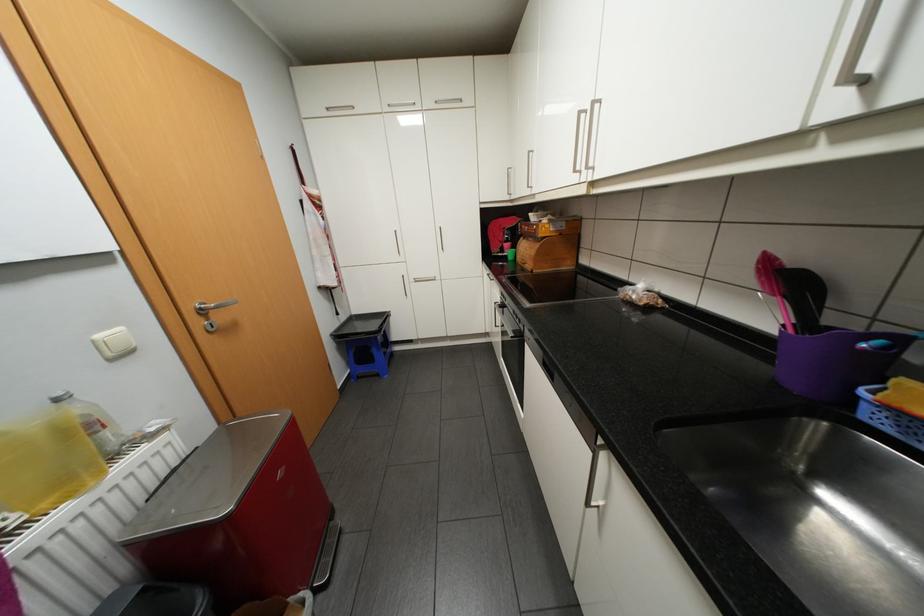
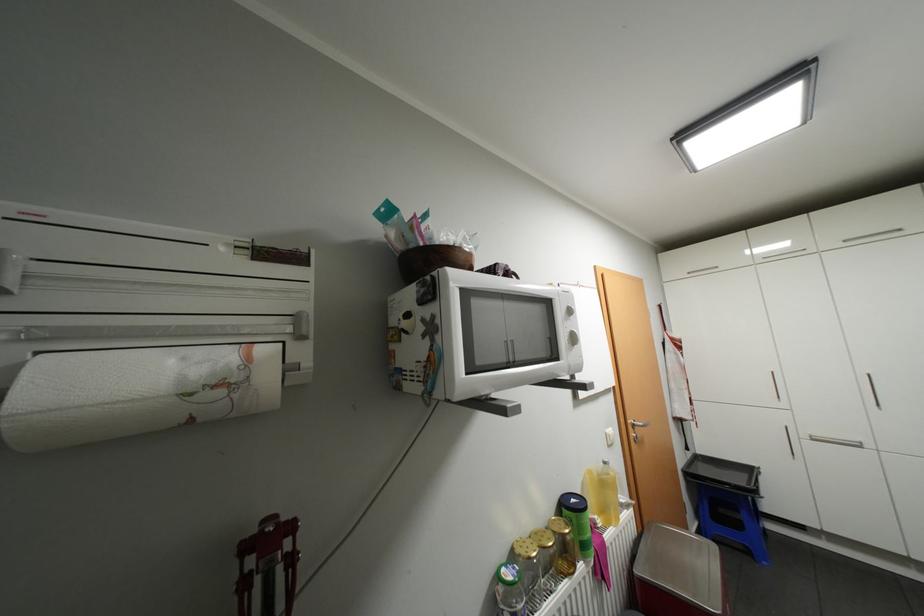
In the second image, find the point that corresponds to the point at 385,374 in the first image.

(756, 552)